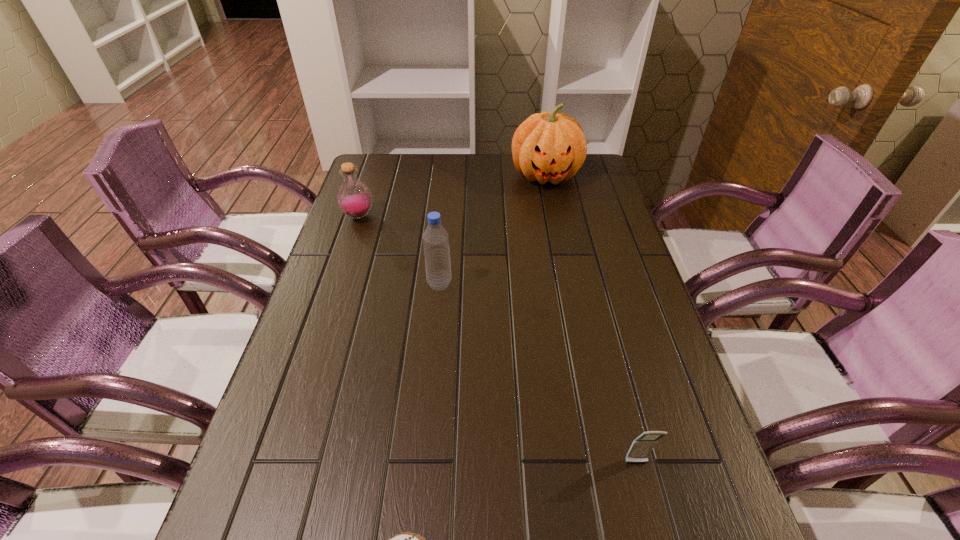
Image resolution: width=960 pixels, height=540 pixels. Identify the location of blank area located on the front-facing side of the fourth farthest object. (648, 508).

Identify the location of object at the far edge. (547, 146).

This screenshot has width=960, height=540. I want to click on object positioned at the left edge, so click(x=354, y=198).

At what (x,y) coordinates should I click in order to perform the action: click on pumpkin located in the right edge section of the desktop. Please return your answer as a coordinate pair (x, y). Looking at the image, I should click on (547, 146).

Find the location of a particular element. This screenshot has width=960, height=540. cellular telephone at the right edge is located at coordinates (641, 447).

Where is `object located at the far right corner`? Image resolution: width=960 pixels, height=540 pixels. object located at the far right corner is located at coordinates click(x=547, y=146).

In the image, there is a desktop. In order to click on free region at the far edge in this screenshot , I will do `click(505, 155)`.

What are the coordinates of `vacant area at the left edge` in the screenshot? It's located at (344, 269).

This screenshot has width=960, height=540. Find the location of `free space at the right edge of the desktop`. free space at the right edge of the desktop is located at coordinates (637, 377).

Where is `vacant point located between the cellular telephone and the farther bottle`? Image resolution: width=960 pixels, height=540 pixels. vacant point located between the cellular telephone and the farther bottle is located at coordinates pos(497,340).